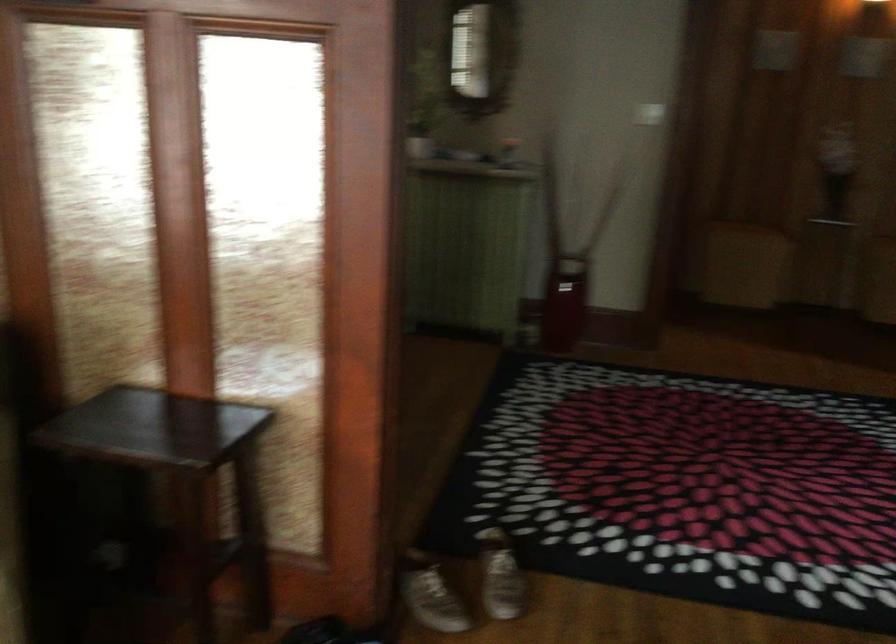
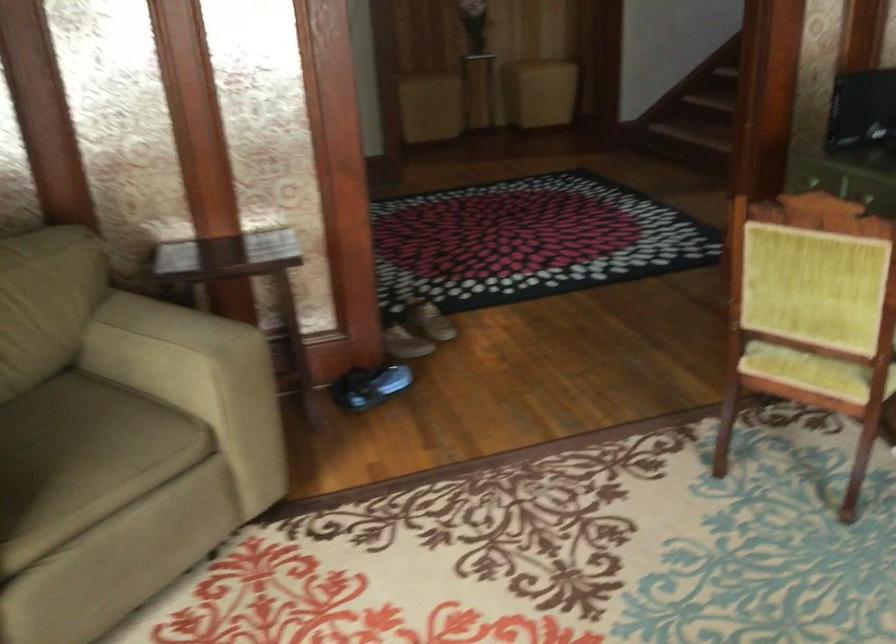
In the second image, find the point that corresponds to point (497, 571) in the first image.

(431, 319)